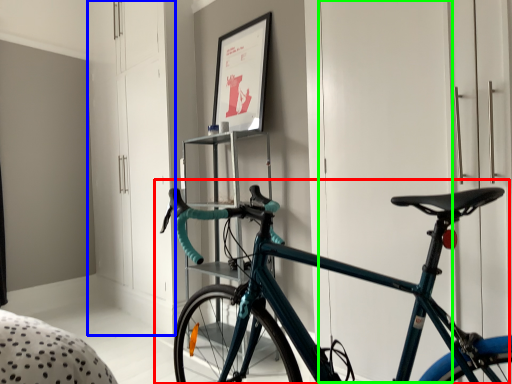
Question: Considering the real-world distances, which object is farthest from bicycle (highlighted by a red box)? dresser (highlighted by a blue box) or door (highlighted by a green box)?

Choices:
 (A) dresser
 (B) door

Answer: (A)